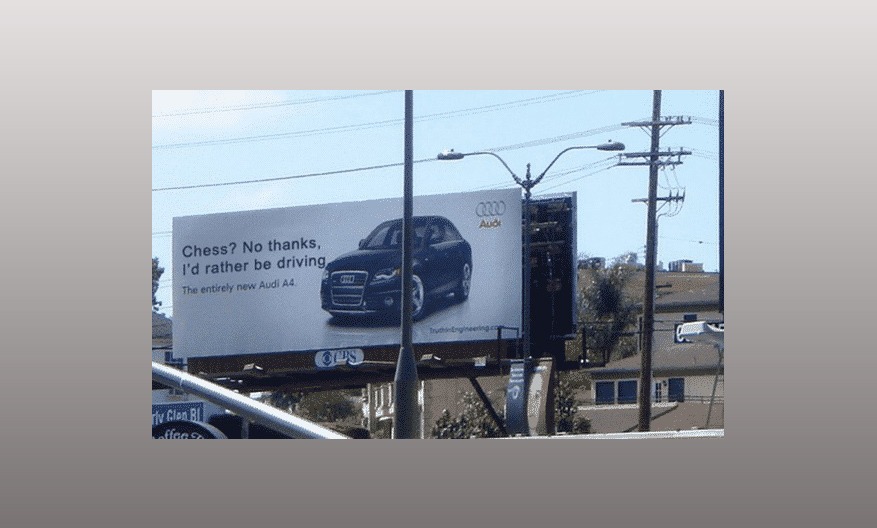
Where is `hood`? The width and height of the screenshot is (877, 528). hood is located at coordinates point(371,256).